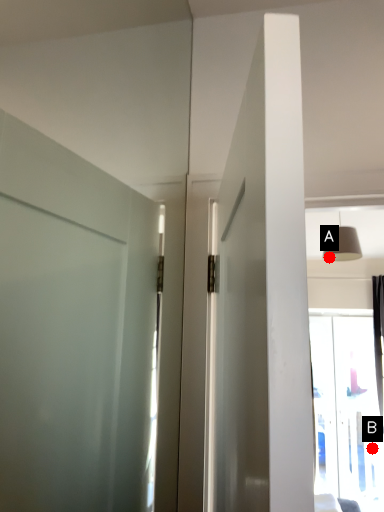
Question: Two points are circled on the image, labeled by A and B beside each circle. Which point is closer to the camera?

Choices:
 (A) A is closer
 (B) B is closer

Answer: (A)